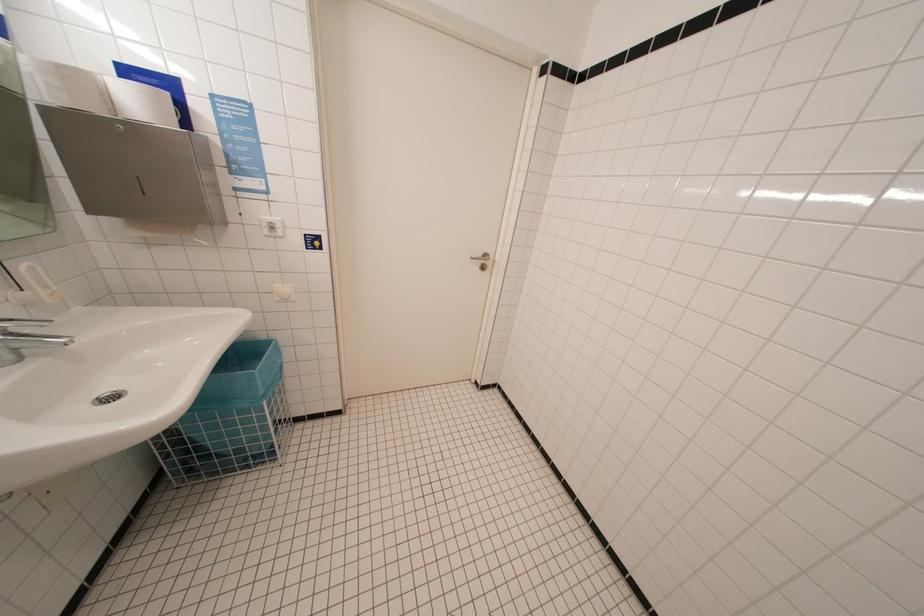
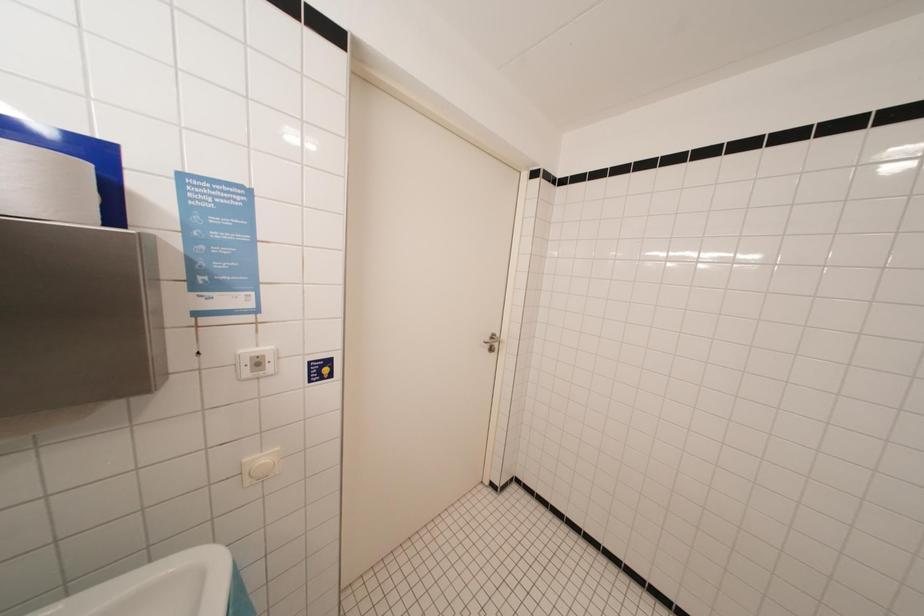
Question: The camera is either moving clockwise (left) or counter-clockwise (right) around the object. The first image is from the beginning of the video and the second image is from the end. Is the camera moving left or right when shooting the video?

Choices:
 (A) Left
 (B) Right

Answer: (A)